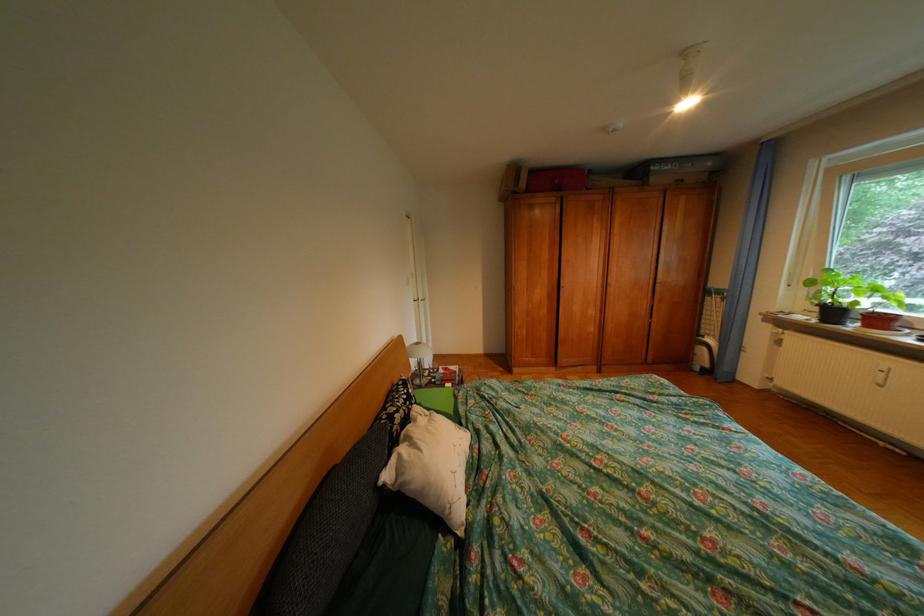
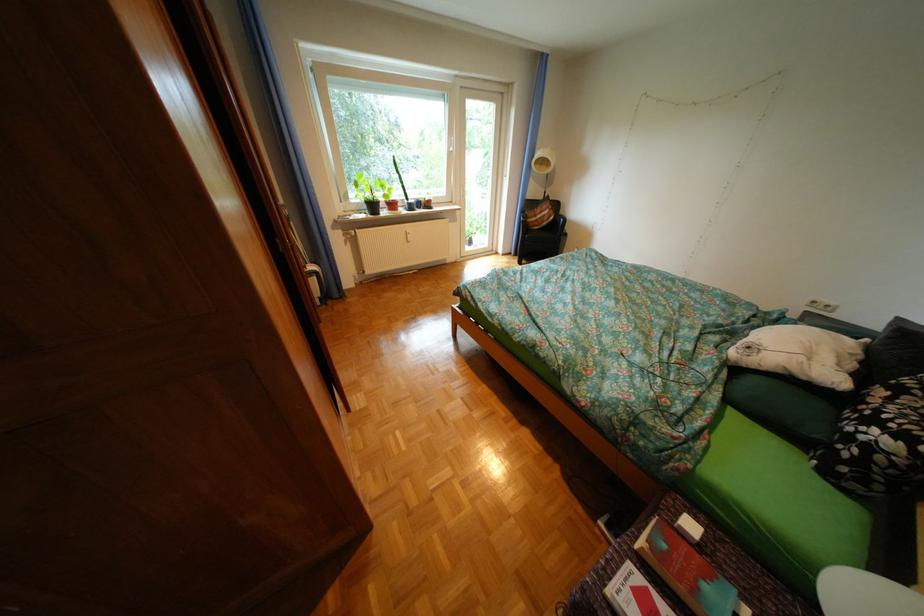
Question: I am providing you with two images of the same scene from different viewpoints. After the viewpoint changes to image2, which objects are now occluded?

Choices:
 (A) white book
 (B) patterned pillow
 (C) white pillow
 (D) none of these

Answer: (D)